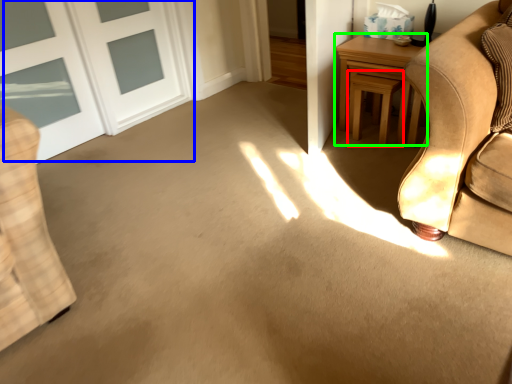
Question: Which object is the closest to the stool (highlighted by a red box)? Choose among these: door (highlighted by a blue box) or table (highlighted by a green box).

Choices:
 (A) door
 (B) table

Answer: (B)